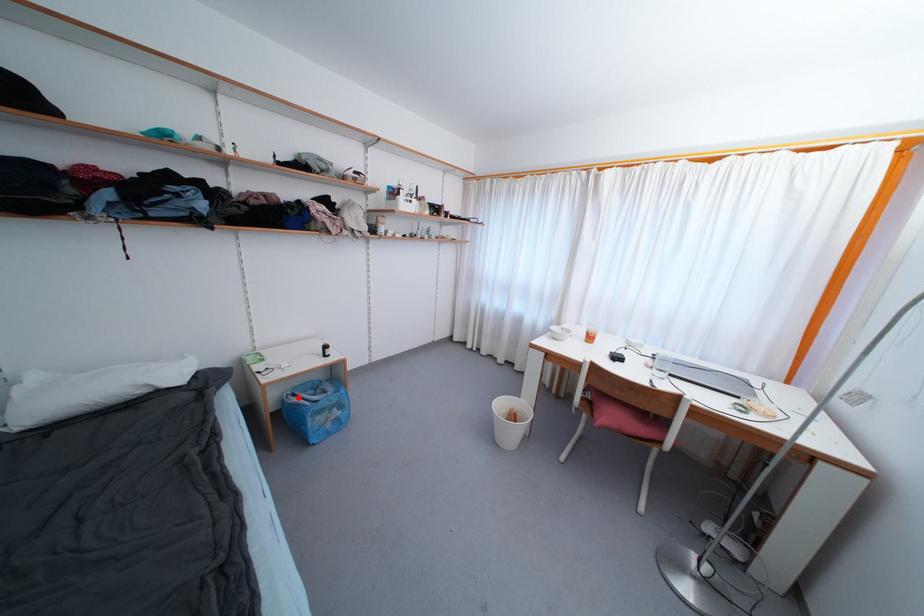
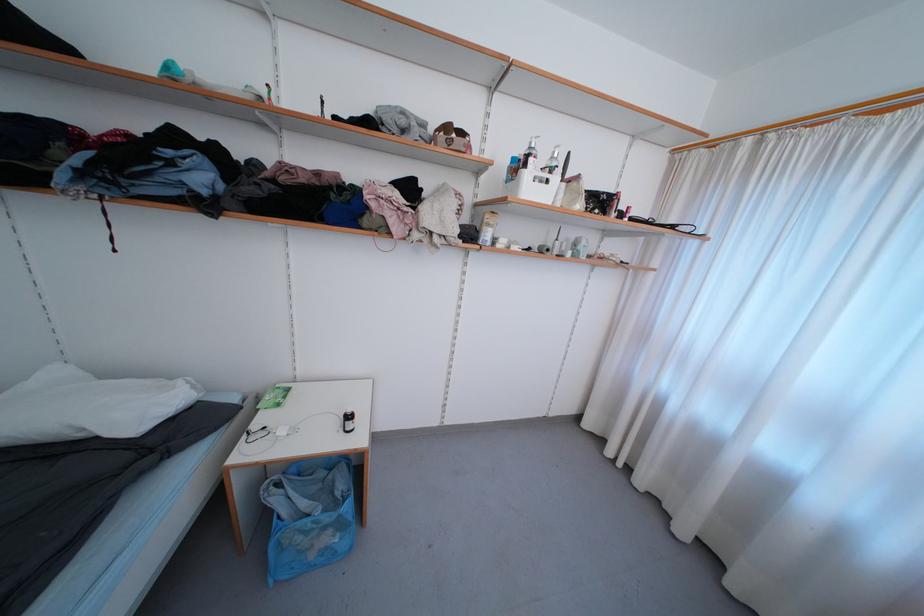
The point at the highlighted location is marked in the first image. Where is the corresponding point in the second image?

(284, 488)